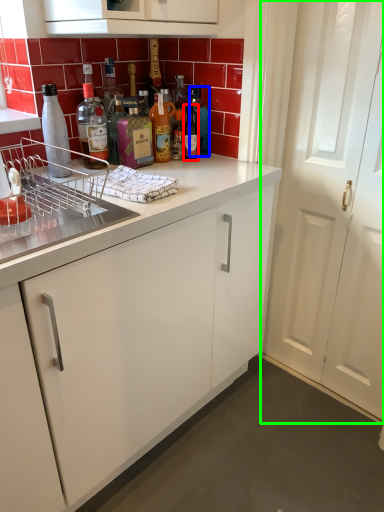
Question: Based on their relative distances, which object is nearer to bottle (highlighted by a red box)? Choose from bottle (highlighted by a blue box) and door (highlighted by a green box).

Choices:
 (A) bottle
 (B) door

Answer: (A)